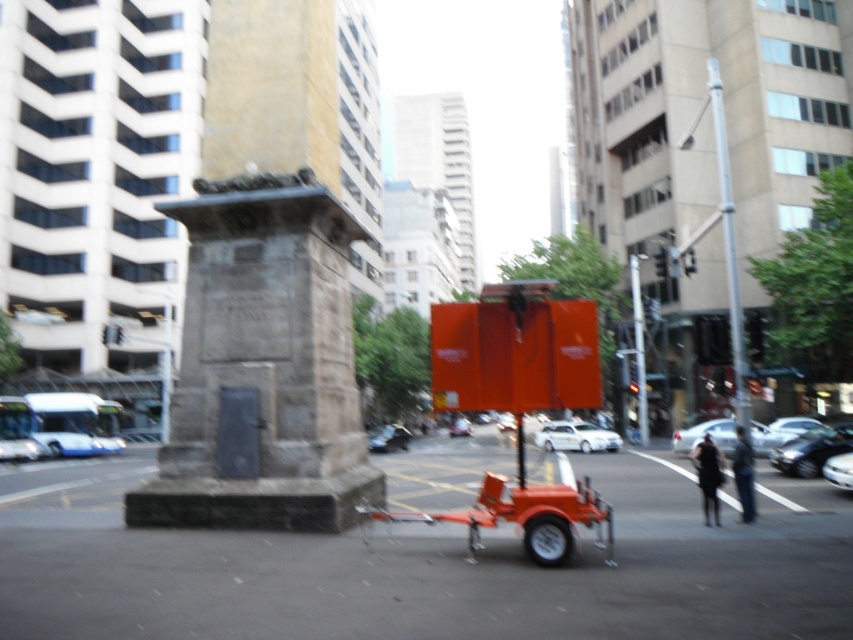
Question: Can you confirm if stone monument at center is wider than shiny silver sedan at lower right?

Choices:
 (A) yes
 (B) no

Answer: (A)

Question: Which point is farther to the camera?

Choices:
 (A) shiny silver sedan at lower right
 (B) metallic silver car at center

Answer: (B)

Question: Among these points, which one is farthest from the camera?

Choices:
 (A) (851, 474)
 (B) (769, 456)
 (C) (720, 419)

Answer: (C)

Question: Can you confirm if stone monument at center is positioned above white glossy car at center?

Choices:
 (A) no
 (B) yes

Answer: (B)

Question: Estimate the real-world distances between objects in this image. Which object is closer to the metallic silver car at center?

Choices:
 (A) stone monument at center
 (B) shiny silver sedan at lower right

Answer: (A)

Question: Can you confirm if white glossy car at center is wider than shiny silver car at center?

Choices:
 (A) no
 (B) yes

Answer: (B)